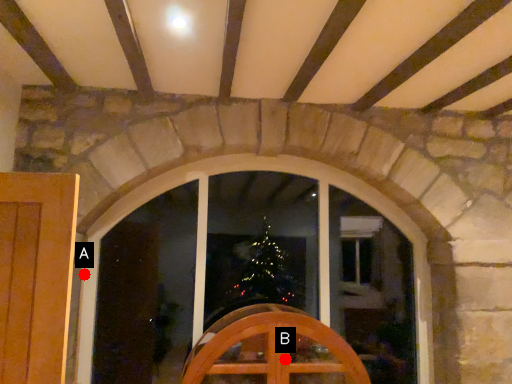
Question: Two points are circled on the image, labeled by A and B beside each circle. Which point is farther from the camera taking this photo?

Choices:
 (A) A is further
 (B) B is further

Answer: (A)